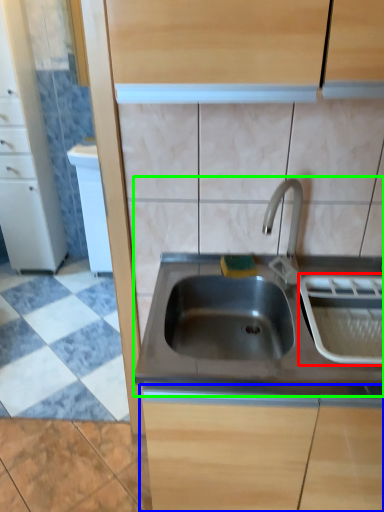
Question: Based on their relative distances, which object is nearer to appliance (highlighted by a red box)? Choose from cabinetry (highlighted by a blue box) and sink (highlighted by a green box).

Choices:
 (A) cabinetry
 (B) sink

Answer: (B)